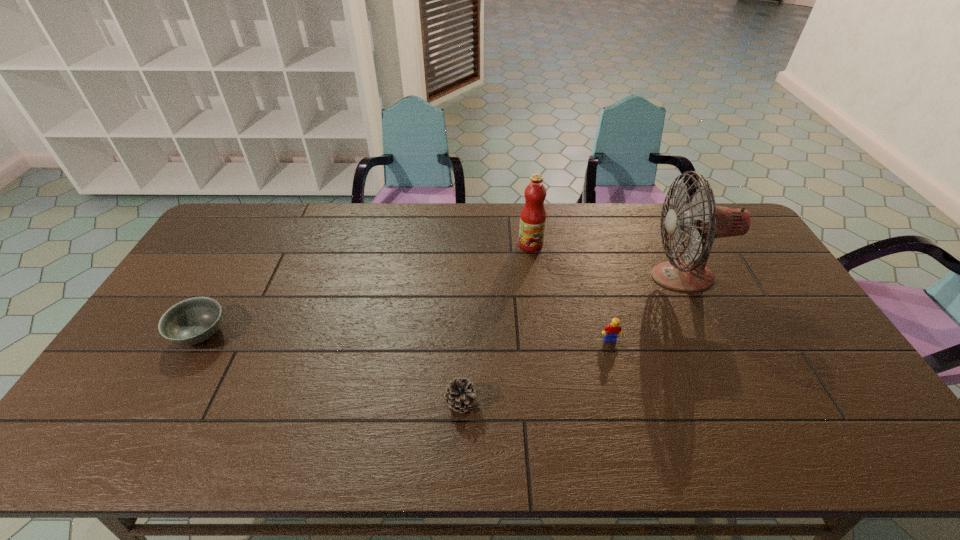
Identify the location of vacant position at the right edge of the desktop. (791, 366).

What are the coordinates of `free space at the far left corner of the desktop` in the screenshot? It's located at (253, 224).

Identify the location of free space between the leftmost object and the fan. (442, 305).

I want to click on empty space that is in between the fan and the fruit juice, so click(607, 260).

Where is `free space between the fruit juice and the tallest object`? This screenshot has width=960, height=540. free space between the fruit juice and the tallest object is located at coordinates (607, 260).

In order to click on empty location between the bowl and the rightmost object in this screenshot , I will do tap(442, 305).

Identify the location of empty space that is in between the fan and the nearest object. Image resolution: width=960 pixels, height=540 pixels. [x=571, y=339].

Identify the location of vacant space that is in between the bowl and the second tallest object. The width and height of the screenshot is (960, 540). (366, 289).

At what (x,y) coordinates should I click in order to perform the action: click on unoccupied area between the tallest object and the bowl. Please return your answer as a coordinate pair (x, y). Looking at the image, I should click on (442, 305).

The width and height of the screenshot is (960, 540). I want to click on vacant area that lies between the third object from right to left and the fan, so click(x=607, y=260).